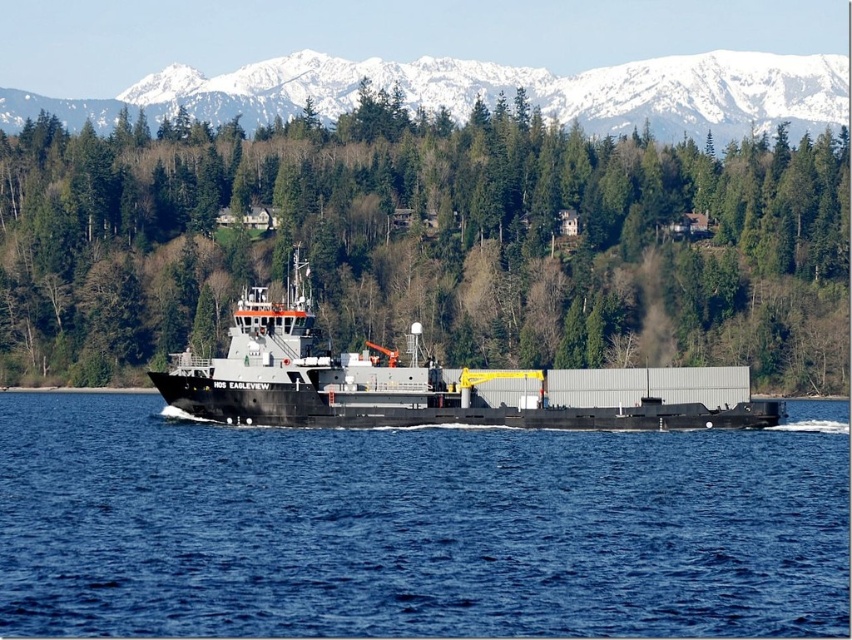
Question: Which point is farther to the camera?

Choices:
 (A) (666, 104)
 (B) (423, 516)

Answer: (A)

Question: Does green matte tree at center have a smaller size compared to snowy white mountain at upper center?

Choices:
 (A) no
 (B) yes

Answer: (A)

Question: Which point is closer to the camera?

Choices:
 (A) snowy white mountain at upper center
 (B) green matte tree at center
 (C) blue water at center
 (D) black matte barge at center

Answer: (C)

Question: Can you confirm if green matte tree at center is positioned below black matte barge at center?

Choices:
 (A) no
 (B) yes

Answer: (A)

Question: Which object is positioned closest to the black matte barge at center?

Choices:
 (A) snowy white mountain at upper center
 (B) green matte tree at center

Answer: (B)

Question: Does green matte tree at center appear under snowy white mountain at upper center?

Choices:
 (A) no
 (B) yes

Answer: (B)